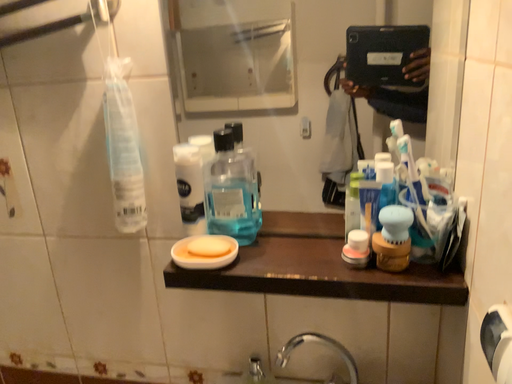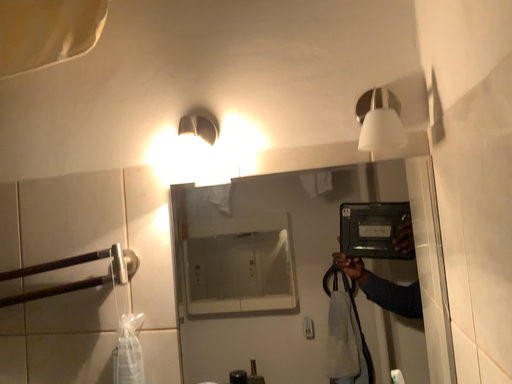
Question: Which way did the camera rotate in the video?

Choices:
 (A) rotated upward
 (B) rotated downward

Answer: (A)